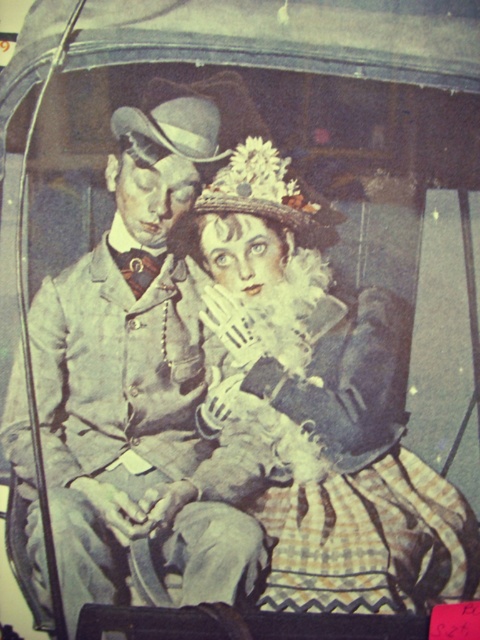
Question: Which point is closer to the camera?

Choices:
 (A) (370, 561)
 (B) (165, 348)

Answer: (A)

Question: Is matte black dress at center smaller than matte gray suit at center?

Choices:
 (A) yes
 (B) no

Answer: (A)

Question: In this image, where is matte black dress at center located relative to matte gray suit at center?

Choices:
 (A) above
 (B) below

Answer: (B)

Question: Does matte black dress at center lie in front of matte gray suit at center?

Choices:
 (A) yes
 (B) no

Answer: (B)

Question: Among these objects, which one is farthest from the camera?

Choices:
 (A) matte black dress at center
 (B) matte gray suit at center

Answer: (A)